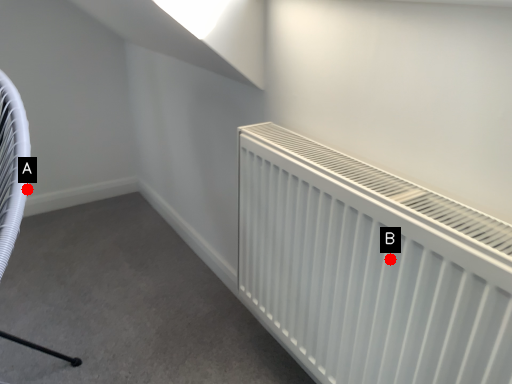
Question: Two points are circled on the image, labeled by A and B beside each circle. Which of the following is the farthest from the observer?

Choices:
 (A) A is further
 (B) B is further

Answer: (A)